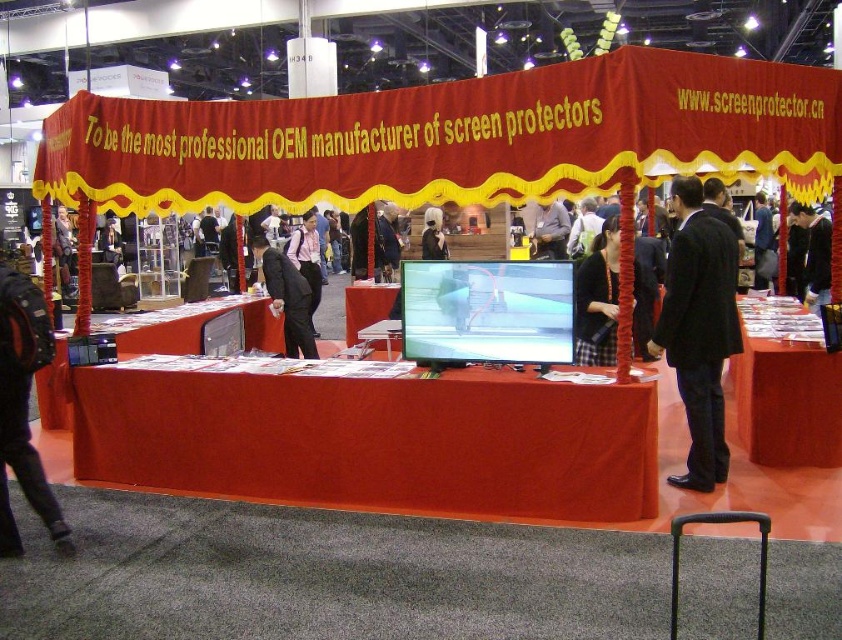
Question: Does dark suit at center have a lesser width compared to black fabric at center?

Choices:
 (A) no
 (B) yes

Answer: (A)

Question: Is black suit at center behind smooth plastic table at center?

Choices:
 (A) no
 (B) yes

Answer: (A)

Question: Among these objects, which one is nearest to the camera?

Choices:
 (A) dark suit at center
 (B) matte red table at center
 (C) black suit at center

Answer: (B)

Question: Which point is farther to the camera?

Choices:
 (A) (589, 392)
 (B) (686, 269)

Answer: (B)

Question: Which of these objects is positioned farthest from the black suit at center?

Choices:
 (A) black fabric coat at center
 (B) smooth plastic table at center
 (C) matte red table at center
 (D) red/yellow fabric canopy at upper center

Answer: (B)

Question: Does red/yellow fabric canopy at upper center appear over smooth glossy table at center?

Choices:
 (A) yes
 (B) no

Answer: (A)